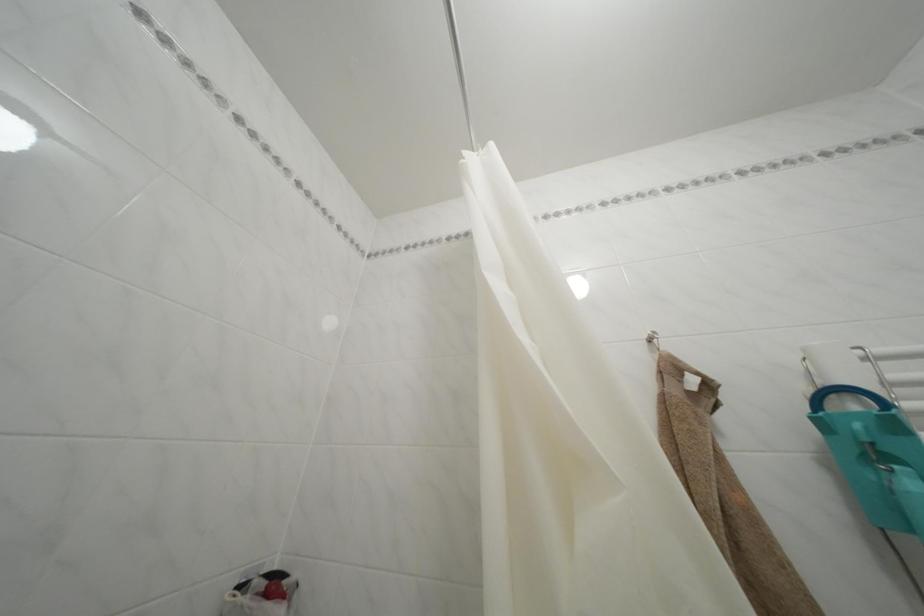
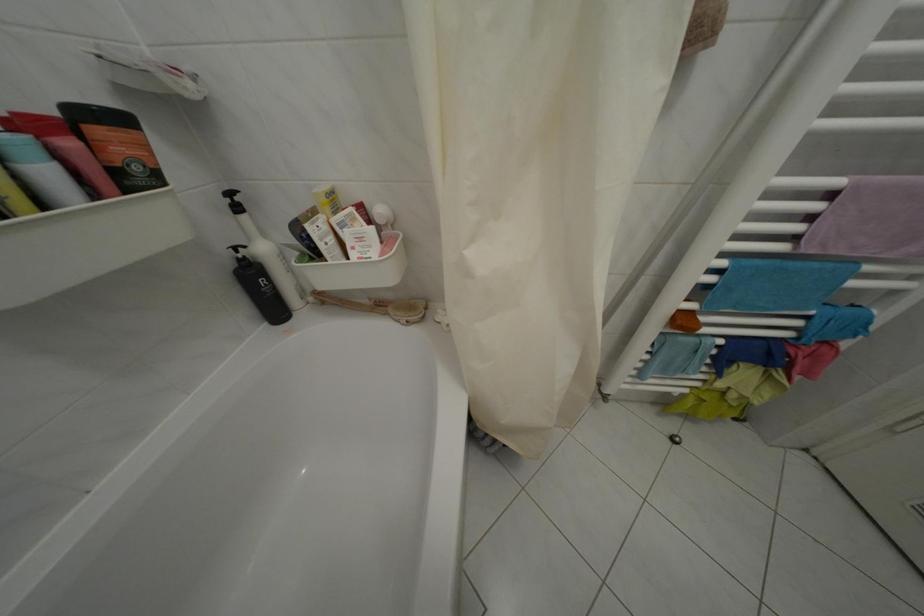
How did the camera likely rotate?

The camera's rotation is toward right-down.